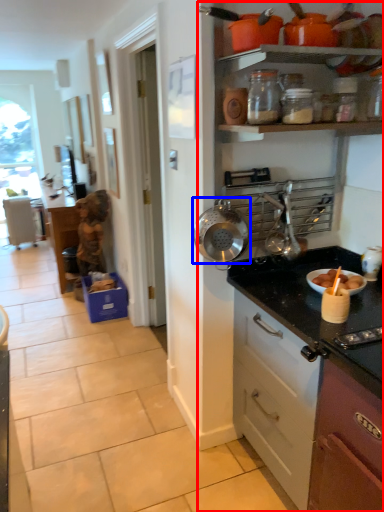
Question: Which point is closer to the camera, dresser (highlighted by a red box) or kitchen appliance (highlighted by a blue box)?

Choices:
 (A) dresser
 (B) kitchen appliance

Answer: (A)